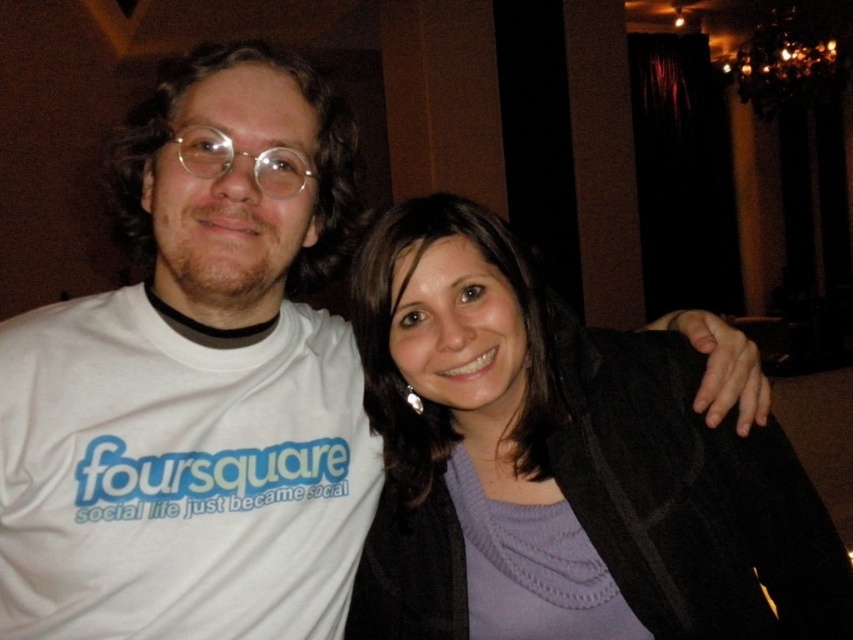
Question: Does white t-shirt at left come in front of purple sweater at center?

Choices:
 (A) yes
 (B) no

Answer: (A)

Question: Observing the image, what is the correct spatial positioning of white t-shirt at left in reference to purple sweater at center?

Choices:
 (A) above
 (B) below

Answer: (A)

Question: Which point is farther from the camera taking this photo?

Choices:
 (A) tap(454, 360)
 (B) tap(270, 637)

Answer: (B)

Question: Which of the following is the closest to the observer?

Choices:
 (A) white t-shirt at left
 (B) purple sweater at center

Answer: (A)

Question: Does white t-shirt at left appear on the left side of purple sweater at center?

Choices:
 (A) no
 (B) yes

Answer: (B)

Question: Which object is closer to the camera taking this photo?

Choices:
 (A) purple sweater at center
 (B) white t-shirt at left

Answer: (B)